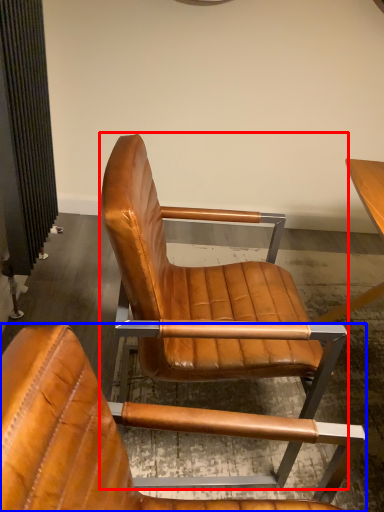
Question: Among these objects, which one is farthest to the camera, chair (highlighted by a red box) or chair (highlighted by a blue box)?

Choices:
 (A) chair
 (B) chair

Answer: (A)